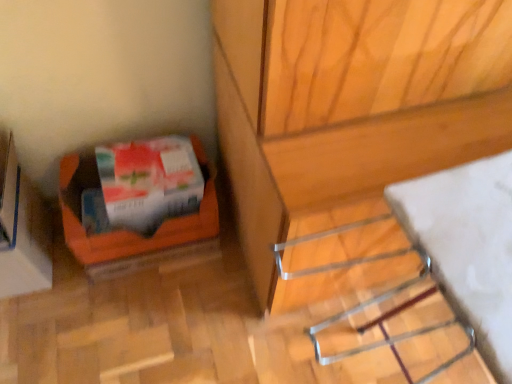
Question: Looking at their shapes, would you say orange cardboard box at lower left is wider or thinner than white glossy wrapping paper at lower left?

Choices:
 (A) thin
 (B) wide

Answer: (B)

Question: Considering the positions of orange cardboard box at lower left and white glossy wrapping paper at lower left in the image, is orange cardboard box at lower left bigger or smaller than white glossy wrapping paper at lower left?

Choices:
 (A) small
 (B) big

Answer: (B)

Question: Which object is the farthest from the orange cardboard box at lower left?

Choices:
 (A) orange cardboard box at lower left
 (B) white glossy wrapping paper at lower left
 (C) metallic silver rack at lower right

Answer: (C)

Question: Which object is the closest to the metallic silver rack at lower right?

Choices:
 (A) orange cardboard box at lower left
 (B) orange cardboard box at lower left
 (C) white glossy wrapping paper at lower left

Answer: (C)